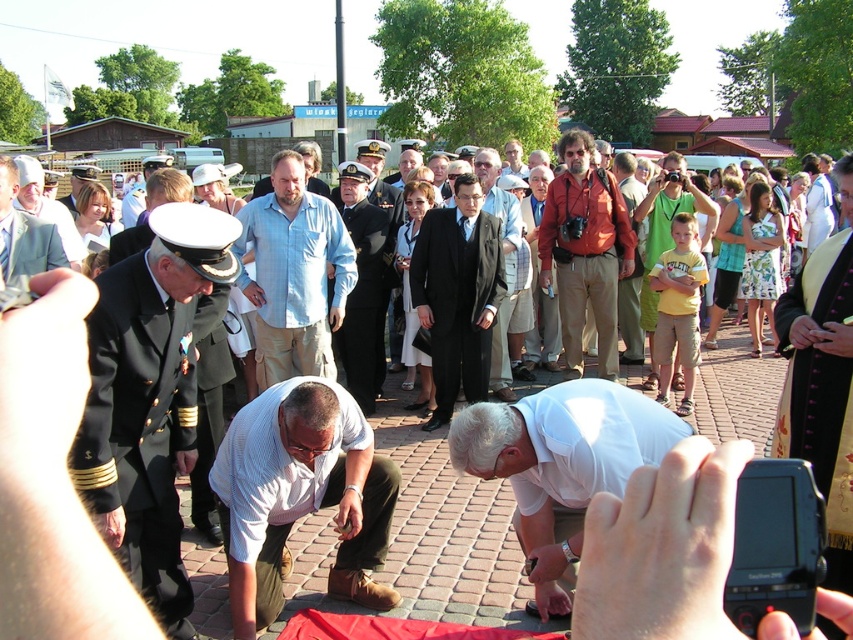
Looking at this image, which is more to the left, matte orange jacket at center or matte black uniform at center?

matte black uniform at center

Who is taller, matte orange jacket at center or matte black uniform at center?

matte black uniform at center is taller.

Is point (582, 262) closer to viewer compared to point (77, 166)?

That is True.

Locate an element on the screen. matte orange jacket at center is located at coordinates (585, 252).

Who is positioned more to the right, matte black suit at center or matte black uniform at center?

Positioned to the right is matte black suit at center.

Is point (469, 268) in front of point (73, 196)?

Yes, point (469, 268) is closer to viewer.

Identify the location of matte black suit at center. The width and height of the screenshot is (853, 640). (457, 294).

Between dark blue uniform at center and white matte shirt at center, which one appears on the left side from the viewer's perspective?

dark blue uniform at center is more to the left.

Can you confirm if dark blue uniform at center is shorter than white matte shirt at center?

Incorrect, dark blue uniform at center's height does not fall short of white matte shirt at center's.

Identify the location of dark blue uniform at center. Image resolution: width=853 pixels, height=640 pixels. (149, 400).